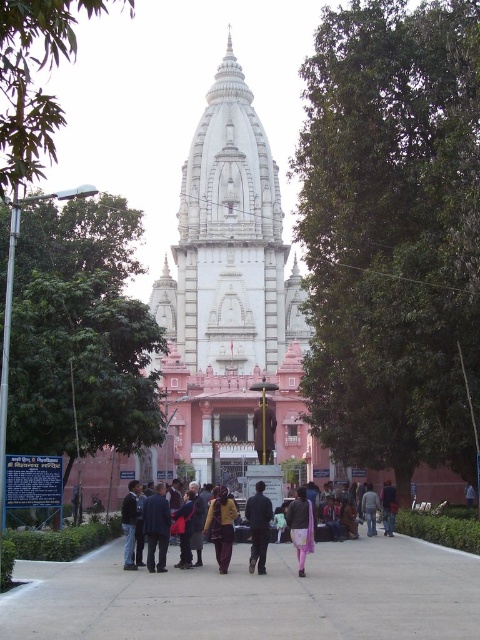
Does dark blue fabric jacket at center have a smaller size compared to yellow fabric dress at center?

Indeed, dark blue fabric jacket at center has a smaller size compared to yellow fabric dress at center.

Is dark blue fabric jacket at center positioned in front of yellow fabric dress at center?

No, it is not.

The height and width of the screenshot is (640, 480). Identify the location of dark blue fabric jacket at center. (156, 528).

Identify the location of dark blue fabric jacket at center. The width and height of the screenshot is (480, 640). (156, 528).

Does dark blue fabric jacket at center come in front of denim jacket at lower center?

Yes.

Does dark blue fabric jacket at center have a greater height compared to denim jacket at lower center?

Yes.

Is point (144, 531) positioned behind point (365, 516)?

That is False.

At what (x,y) coordinates should I click in order to perform the action: click on dark blue fabric jacket at center. Please return your answer as a coordinate pair (x, y). This screenshot has width=480, height=640. Looking at the image, I should click on (156, 528).

What do you see at coordinates (229, 243) in the screenshot?
I see `white marble hindu temple at center` at bounding box center [229, 243].

Is point (261, 333) in front of point (291, 536)?

No.

Locate an element on the screen. The height and width of the screenshot is (640, 480). white marble hindu temple at center is located at coordinates (229, 243).